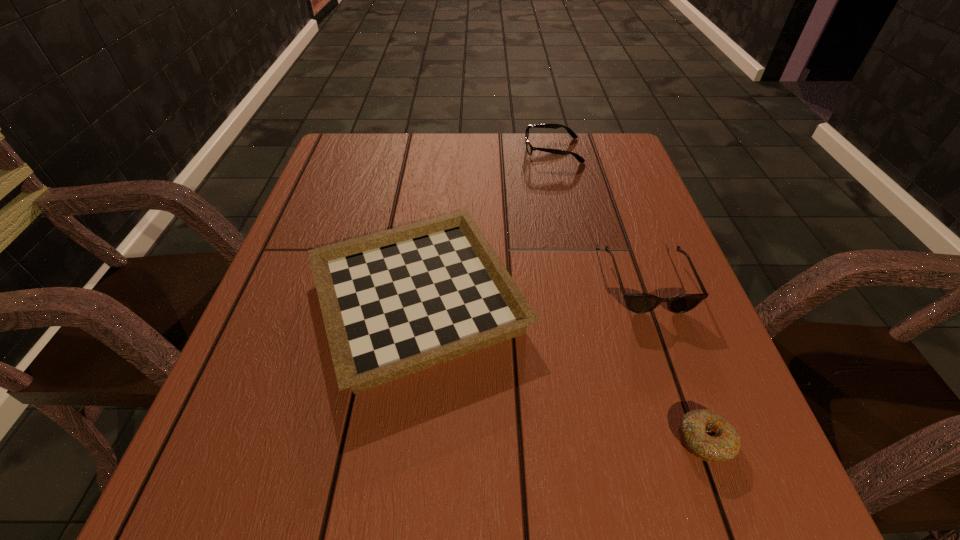
In order to click on free space between the sunglasses and the spectacles in this screenshot , I will do `click(600, 217)`.

Locate an element on the screen. The width and height of the screenshot is (960, 540). vacant space that's between the checkerboard and the farthest object is located at coordinates (485, 225).

Where is `free space between the farthest object and the sunglasses`? Image resolution: width=960 pixels, height=540 pixels. free space between the farthest object and the sunglasses is located at coordinates (600, 217).

The width and height of the screenshot is (960, 540). I want to click on object that stands as the second closest to the leftmost object, so click(707, 435).

At what (x,y) coordinates should I click in order to perform the action: click on object that is the third closest one to the spectacles. Please return your answer as a coordinate pair (x, y). The width and height of the screenshot is (960, 540). Looking at the image, I should click on (707, 435).

In order to click on vacant space that satisfies the following two spatial constraints: 1. on the front-facing side of the farthest object; 2. on the right side of the doughnut in this screenshot , I will do `click(616, 440)`.

Where is `vacant area that satisfies the following two spatial constraints: 1. on the front-facing side of the shortest object; 2. on the left side of the farthest object`? This screenshot has height=540, width=960. vacant area that satisfies the following two spatial constraints: 1. on the front-facing side of the shortest object; 2. on the left side of the farthest object is located at coordinates (616, 440).